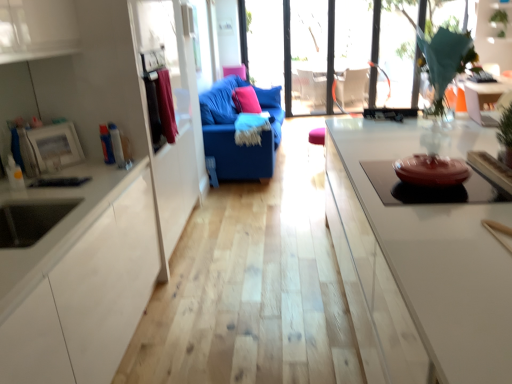
Where is `transparent glass window at upper center, which is counted as the 2th window, starting from the left`? The image size is (512, 384). transparent glass window at upper center, which is counted as the 2th window, starting from the left is located at coordinates (401, 49).

Locate an element on the screen. This screenshot has height=384, width=512. transparent glass window at upper center, positioned as the first window in left-to-right order is located at coordinates (331, 54).

This screenshot has height=384, width=512. Find the location of `white glossy table at upper right`. white glossy table at upper right is located at coordinates (485, 99).

Considering the relative sizes of green leafy plant at upper right and pink fabric pillow at center, which appears as the 1th pillow when viewed from the front, in the image provided, is green leafy plant at upper right bigger than pink fabric pillow at center, which appears as the 1th pillow when viewed from the front,?

Yes.

Is green leafy plant at upper right to the right of pink fabric pillow at center, the 2th pillow when ordered from back to front, from the viewer's perspective?

Yes, green leafy plant at upper right is to the right of pink fabric pillow at center, the 2th pillow when ordered from back to front.

Are green leafy plant at upper right and pink fabric pillow at center, the 2th pillow when ordered from back to front, far apart?

Yes.

Image resolution: width=512 pixels, height=384 pixels. Find the location of `plant above the pink fabric pillow at center, the 2th pillow when ordered from back to front (from a real-world perspective)`. plant above the pink fabric pillow at center, the 2th pillow when ordered from back to front (from a real-world perspective) is located at coordinates (500, 22).

Who is shorter, white glossy table at upper right or velvet blue sofa at center?

white glossy table at upper right.

Locate an element on the screen. The height and width of the screenshot is (384, 512). table below the velvet blue sofa at center (from the image's perspective) is located at coordinates (485, 99).

Is point (481, 112) positioned in front of point (267, 172)?

Yes, it is.

Is white glossy table at upper right wider than velvet blue sofa at center?

No.

From the image's perspective, is velvet blue sofa at center beneath white glossy table at upper right?

No, from the image's perspective, velvet blue sofa at center is not beneath white glossy table at upper right.

Which object is further away from the camera, velvet blue sofa at center or white glossy table at upper right?

velvet blue sofa at center is behind.

Can you see velvet blue sofa at center touching white glossy table at upper right?

No, velvet blue sofa at center is not beside white glossy table at upper right.

From a real-world perspective, between velvet blue sofa at center and white glossy table at upper right, who is vertically higher?

In real-world perspective, white glossy table at upper right is above.

Relative to transparent glass window at upper center, positioned as the 1th window in right-to-left order, is pink fabric pillow at center, the 2th pillow when ordered from back to front, in front or behind?

Visually, pink fabric pillow at center, the 2th pillow when ordered from back to front, is located in front of transparent glass window at upper center, positioned as the 1th window in right-to-left order.

Is pink fabric pillow at center, the 2th pillow when ordered from back to front, taller or shorter than transparent glass window at upper center, which is counted as the 2th window, starting from the left?

Clearly, pink fabric pillow at center, the 2th pillow when ordered from back to front, is shorter compared to transparent glass window at upper center, which is counted as the 2th window, starting from the left.

Considering the relative sizes of pink fabric pillow at center, the 2th pillow when ordered from back to front, and transparent glass window at upper center, positioned as the 1th window in right-to-left order, in the image provided, is pink fabric pillow at center, the 2th pillow when ordered from back to front, bigger than transparent glass window at upper center, positioned as the 1th window in right-to-left order,?

Incorrect, pink fabric pillow at center, the 2th pillow when ordered from back to front, is not larger than transparent glass window at upper center, positioned as the 1th window in right-to-left order.

Starting from the pink fabric pillow at center, the 2th pillow when ordered from back to front, which window is the 2nd one behind? Please provide its 2D coordinates.

[(401, 49)]

Are velvet blue sofa at center and transparent glass door at center making contact?

No, velvet blue sofa at center is not in contact with transparent glass door at center.

Visually, is velvet blue sofa at center positioned to the left or to the right of transparent glass door at center?

From the image, it's evident that velvet blue sofa at center is to the left of transparent glass door at center.

Is velvet blue sofa at center facing away from transparent glass door at center?

No, velvet blue sofa at center is not facing the opposite direction of transparent glass door at center.

From the image's perspective, is velvet blue sofa at center positioned above or below transparent glass door at center?

velvet blue sofa at center is below transparent glass door at center.

Considering the positions of objects transparent glass door at center and transparent glass window at upper center, acting as the 2th window starting from the right, in the image provided, who is more to the left, transparent glass door at center or transparent glass window at upper center, acting as the 2th window starting from the right,?

transparent glass door at center.

Which is in front, point (318, 50) or point (402, 38)?

The point (402, 38) is closer.

Considering the relative sizes of transparent glass door at center and transparent glass window at upper center, positioned as the first window in left-to-right order, in the image provided, is transparent glass door at center taller than transparent glass window at upper center, positioned as the first window in left-to-right order,?

Indeed, transparent glass door at center has a greater height compared to transparent glass window at upper center, positioned as the first window in left-to-right order.

Is velvet blue sofa at center positioned in front of transparent glass window at upper center, which is counted as the 2th window, starting from the left?

Yes, velvet blue sofa at center is closer to the camera.

Considering the sizes of objects velvet blue sofa at center and transparent glass window at upper center, which is counted as the 2th window, starting from the left, in the image provided, who is taller, velvet blue sofa at center or transparent glass window at upper center, which is counted as the 2th window, starting from the left,?

transparent glass window at upper center, which is counted as the 2th window, starting from the left.

From the image's perspective, who appears lower, velvet blue sofa at center or transparent glass window at upper center, positioned as the 1th window in right-to-left order?

velvet blue sofa at center appears lower in the image.

Where is `studio couch below the transparent glass window at upper center, which is counted as the 2th window, starting from the left (from the image's perspective)`? Image resolution: width=512 pixels, height=384 pixels. studio couch below the transparent glass window at upper center, which is counted as the 2th window, starting from the left (from the image's perspective) is located at coordinates pyautogui.click(x=234, y=132).

The height and width of the screenshot is (384, 512). I want to click on the 2nd pillow located beneath the green leafy plant at upper right (from a real-world perspective), so click(x=246, y=100).

You are a GUI agent. You are given a task and a screenshot of the screen. Output one action in this format:
    pyautogui.click(x=<x>, y=<y>)
    Task: Click on the studio couch above the white glossy table at upper right (from the image's perspective)
    Image resolution: width=512 pixels, height=384 pixels.
    Given the screenshot: What is the action you would take?
    pyautogui.click(x=234, y=132)

Considering their positions, is transparent glass window at upper center, positioned as the 1th window in right-to-left order, positioned closer to white glossy table at upper right than velvet blue sofa at center?

The object closer to white glossy table at upper right is velvet blue sofa at center.

From the image, which object appears to be farther from pink fabric pillow at center, which appears as the 1th pillow when viewed from the front, green leafy plant at upper right or pink fabric pillow at center, the 1th pillow when ordered from back to front?

Based on the image, green leafy plant at upper right appears to be further to pink fabric pillow at center, which appears as the 1th pillow when viewed from the front.

Based on their spatial positions, is transparent glass window at upper center, which is counted as the 2th window, starting from the left, or transparent glass door at center closer to pink fabric pillow at center, placed as the 2th pillow when sorted from front to back?

The object closer to pink fabric pillow at center, placed as the 2th pillow when sorted from front to back, is transparent glass door at center.

Which object lies nearer to the anchor point transparent glass window at upper center, positioned as the first window in left-to-right order, green leafy plant at upper right or velvet blue sofa at center?

Among the two, velvet blue sofa at center is located nearer to transparent glass window at upper center, positioned as the first window in left-to-right order.

Estimate the real-world distances between objects in this image. Which object is closer to transparent glass window at upper center, acting as the 2th window starting from the right, transparent glass door at center or green leafy plant at upper right?

transparent glass door at center lies closer to transparent glass window at upper center, acting as the 2th window starting from the right, than the other object.

Which object lies nearer to the anchor point velvet blue sofa at center, transparent glass window at upper center, positioned as the 1th window in right-to-left order, or transparent glass window at upper center, acting as the 2th window starting from the right?

transparent glass window at upper center, acting as the 2th window starting from the right, is positioned closer to the anchor velvet blue sofa at center.

Estimate the real-world distances between objects in this image. Which object is closer to transparent glass window at upper center, positioned as the 1th window in right-to-left order, green leafy plant at upper right or velvet blue sofa at center?

velvet blue sofa at center is positioned closer to the anchor transparent glass window at upper center, positioned as the 1th window in right-to-left order.

Looking at the image, which one is located closer to transparent glass door at center, white glossy table at upper right or velvet blue sofa at center?

velvet blue sofa at center is closer to transparent glass door at center.

The width and height of the screenshot is (512, 384). What are the coordinates of `window located between white glossy table at upper right and transparent glass window at upper center, which is counted as the 2th window, starting from the left, in the depth direction` in the screenshot? It's located at (331, 54).

Find the location of a particular element. This screenshot has width=512, height=384. pillow between pink fabric pillow at center, which appears as the 1th pillow when viewed from the front, and transparent glass window at upper center, acting as the 2th window starting from the right is located at coordinates click(x=269, y=96).

The height and width of the screenshot is (384, 512). I want to click on table situated between pink fabric pillow at center, which appears as the 1th pillow when viewed from the front, and green leafy plant at upper right from left to right, so click(x=485, y=99).

Identify the location of studio couch between white glossy table at upper right and transparent glass window at upper center, positioned as the 1th window in right-to-left order, along the z-axis. The height and width of the screenshot is (384, 512). (234, 132).